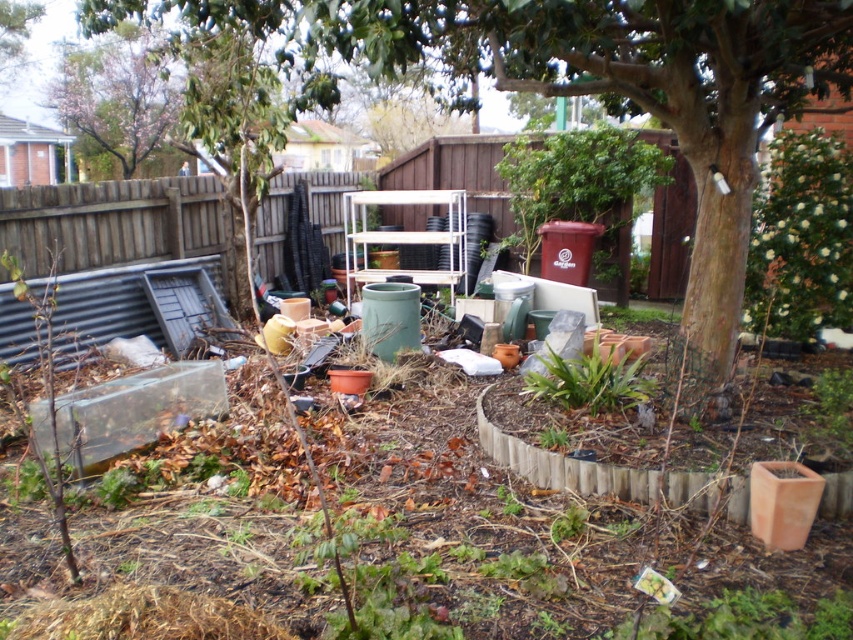
Question: Which point appears closest to the camera in this image?

Choices:
 (A) click(172, 83)
 (B) click(613, 376)
 (C) click(44, 268)

Answer: (B)

Question: Among these objects, which one is farthest from the camera?

Choices:
 (A) terracotta clay planter at lower right
 (B) green leafy plant at center
 (C) brown wooden fence at upper left
 (D) green leafy tree at center

Answer: (C)

Question: Can you confirm if green leafy tree at center is bigger than cherry blossom tree at upper left?

Choices:
 (A) no
 (B) yes

Answer: (B)

Question: Is green leafy plant at center to the left of terracotta clay planter at lower right from the viewer's perspective?

Choices:
 (A) no
 (B) yes

Answer: (B)

Question: Can you confirm if brown wooden fence at upper left is smaller than green leafy plant at center?

Choices:
 (A) no
 (B) yes

Answer: (A)

Question: Which point is farther to the camera?

Choices:
 (A) cherry blossom tree at upper left
 (B) terracotta clay planter at lower right
 (C) green leafy plant at center

Answer: (A)